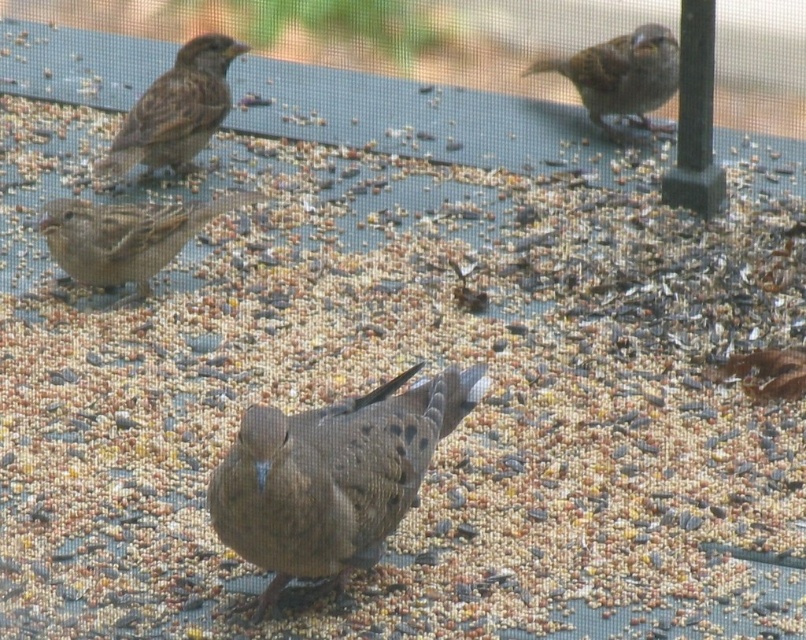
Question: Is the position of brown speckled sparrow at center less distant than that of brown matte sparrow at left?

Choices:
 (A) yes
 (B) no

Answer: (A)

Question: Which point appears closest to the camera in this image?

Choices:
 (A) tap(73, 228)
 (B) tap(634, 38)
 (C) tap(194, 152)
 (D) tap(447, 401)

Answer: (D)

Question: Is brown feathered sparrow at upper left wider than brown matte sparrow at upper right?

Choices:
 (A) yes
 (B) no

Answer: (A)

Question: Which of the following is the closest to the observer?

Choices:
 (A) (133, 116)
 (B) (671, 61)
 (C) (429, 388)
 (D) (52, 208)

Answer: (C)

Question: Which of the following is the closest to the observer?

Choices:
 (A) brown matte sparrow at left
 (B) brown feathered sparrow at upper left
 (C) brown speckled sparrow at center
 (D) brown matte sparrow at upper right

Answer: (C)

Question: Can you confirm if brown speckled sparrow at center is bigger than brown matte sparrow at upper right?

Choices:
 (A) no
 (B) yes

Answer: (B)